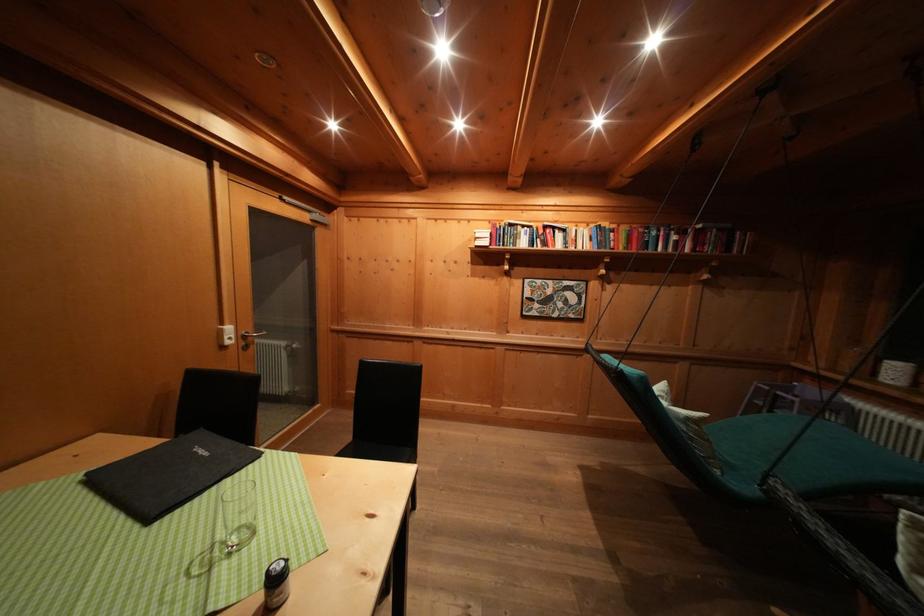
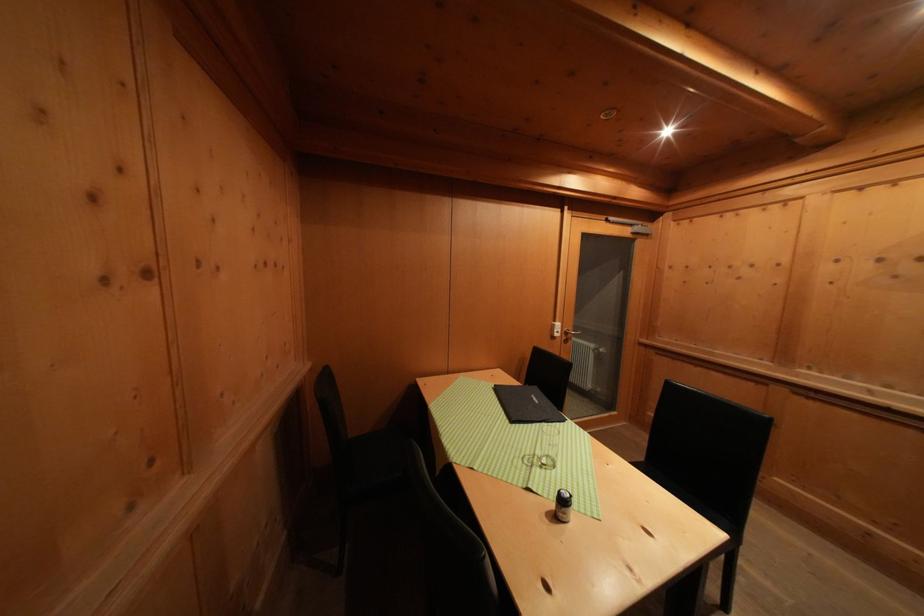
The point at (283, 585) is marked in the first image. Where is the corresponding point in the second image?

(569, 506)